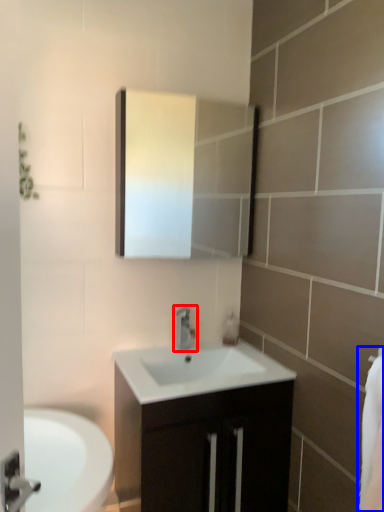
Question: Which of the following is the farthest to the observer, tap (highlighted by a red box) or bath towel (highlighted by a blue box)?

Choices:
 (A) tap
 (B) bath towel

Answer: (A)